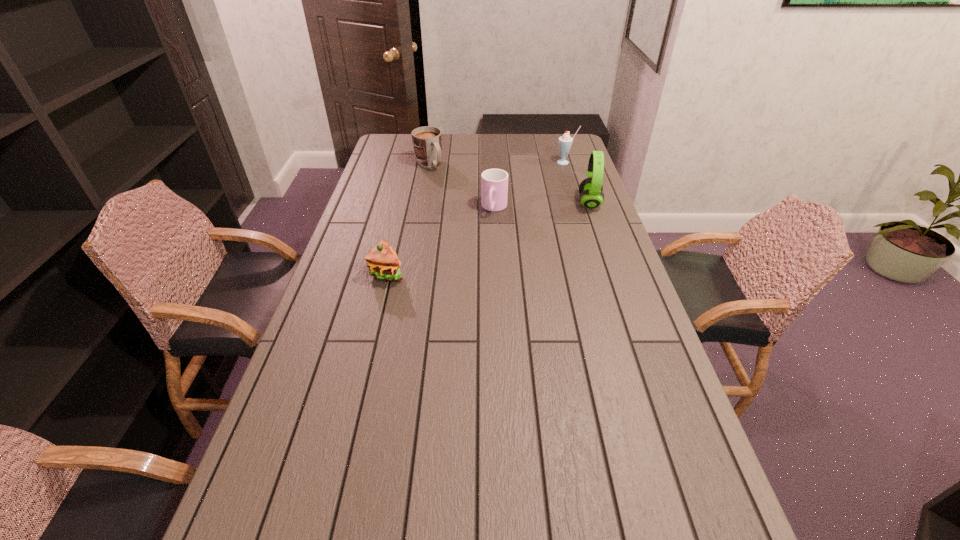
This screenshot has height=540, width=960. I want to click on vacant space located on the straw side of the fourth shortest object, so click(x=553, y=176).

I want to click on vacant region located on the straw side of the fourth shortest object, so click(x=544, y=187).

Locate an element on the screen. blank area located 0.360m on the straw side of the fourth shortest object is located at coordinates (530, 204).

Where is `vacant space located 0.060m on the side of the mug with the handle`? Image resolution: width=960 pixels, height=540 pixels. vacant space located 0.060m on the side of the mug with the handle is located at coordinates (442, 178).

Locate an element on the screen. vacant space located 0.060m on the side of the mug with the handle is located at coordinates (442, 178).

The width and height of the screenshot is (960, 540). In order to click on vacant position located 0.380m on the side of the mug with the handle in this screenshot , I will do `click(480, 215)`.

Image resolution: width=960 pixels, height=540 pixels. What are the coordinates of `object located at the far edge` in the screenshot? It's located at (427, 141).

Locate an element on the screen. This screenshot has width=960, height=540. object at the left edge is located at coordinates (383, 263).

Where is `headset that is at the right edge`? The image size is (960, 540). headset that is at the right edge is located at coordinates (591, 193).

Find the location of a particular element. This screenshot has width=960, height=540. milkshake at the right edge is located at coordinates (565, 141).